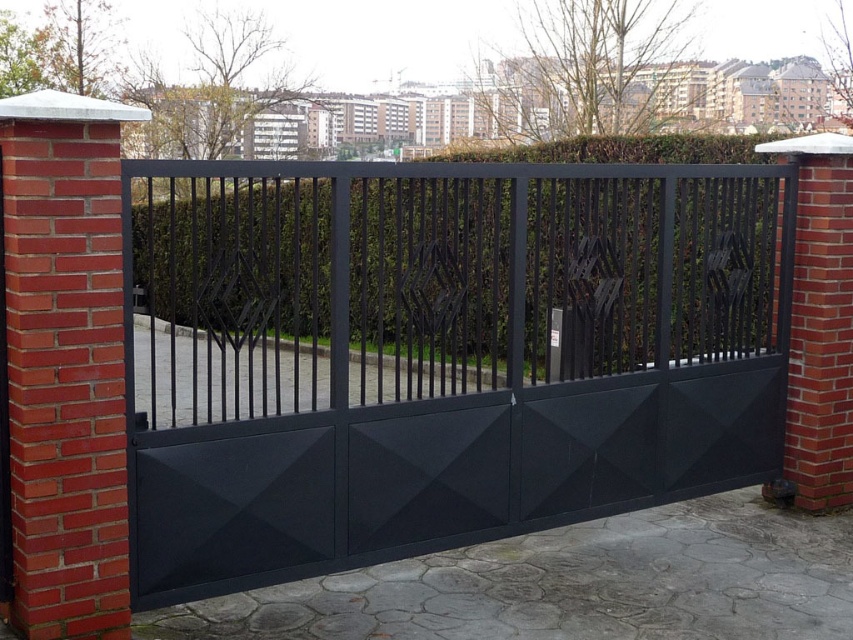
Question: Which point is closer to the camera?

Choices:
 (A) (433, 342)
 (B) (467, 355)

Answer: (A)

Question: Can you confirm if matte black gate at center is wider than green leafy hedge at center?

Choices:
 (A) no
 (B) yes

Answer: (A)

Question: Can you confirm if matte black gate at center is positioned below green leafy hedge at center?

Choices:
 (A) yes
 (B) no

Answer: (A)

Question: Is matte black gate at center bigger than green leafy hedge at center?

Choices:
 (A) yes
 (B) no

Answer: (B)